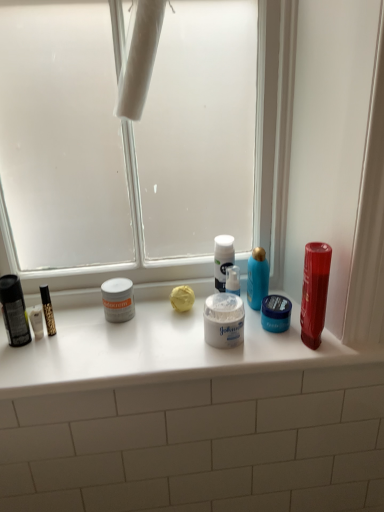
This screenshot has height=512, width=384. What are the coordinates of `unoccupied area in front of blue glossy bottle at center` in the screenshot? It's located at click(x=275, y=348).